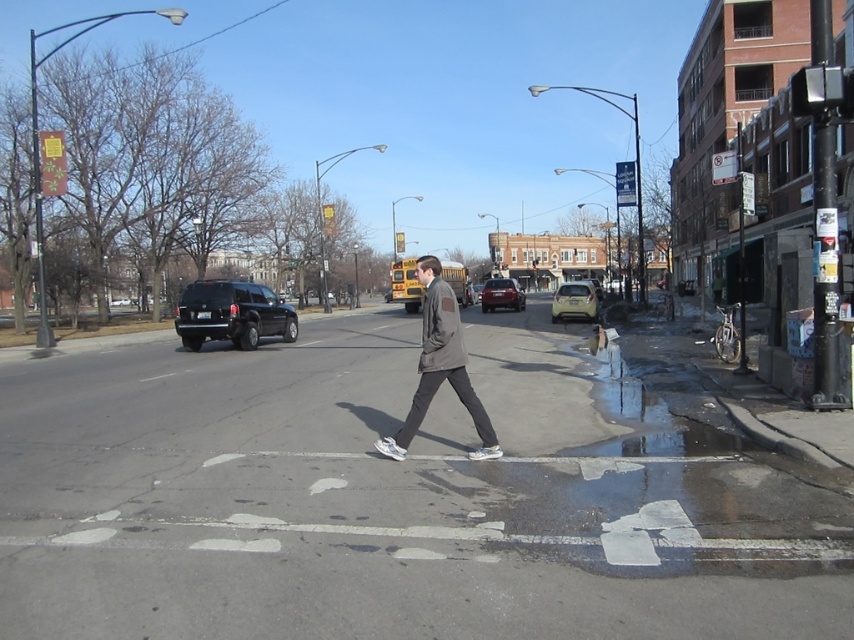
Question: Among these points, which one is farthest from the camera?

Choices:
 (A) (559, 292)
 (B) (214, 401)
 (C) (506, 296)

Answer: (C)

Question: Where is shiny black suv at left located in relation to matte red car at center in the image?

Choices:
 (A) below
 (B) above

Answer: (A)

Question: Is dark gray fabric jacket at center smaller than shiny black suv at left?

Choices:
 (A) yes
 (B) no

Answer: (B)

Question: Based on their relative distances, which object is farther from the dark gray fabric jacket at center?

Choices:
 (A) matte red car at center
 (B) shiny black suv at left
 (C) matte gray crosswalk at center

Answer: (A)

Question: Among these points, which one is farthest from the camera?

Choices:
 (A) (424, 289)
 (B) (225, 525)
 (C) (589, 320)
 (D) (255, 300)

Answer: (A)

Question: Does dark gray fabric jacket at center have a larger size compared to shiny black suv at left?

Choices:
 (A) no
 (B) yes

Answer: (B)